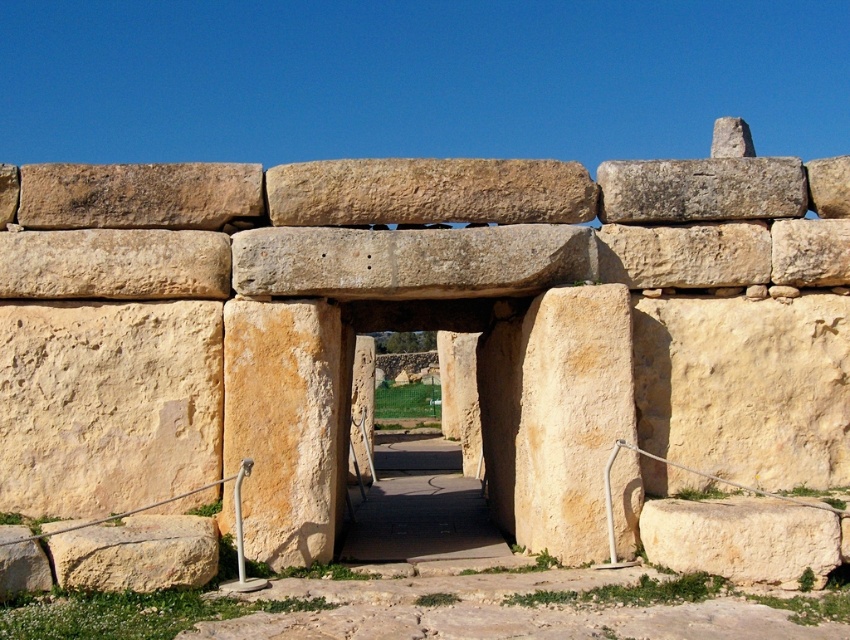
Is yellowish stone at upper right below beige rough stone at lower left?

No.

Can you confirm if yellowish stone at upper right is bigger than beige rough stone at lower left?

Indeed, yellowish stone at upper right has a larger size compared to beige rough stone at lower left.

Is point (833, 220) more distant than point (41, 561)?

Yes, it is behind point (41, 561).

What are the coordinates of `yellowish stone at upper right` in the screenshot? It's located at (809, 252).

Between yellowish sandstone at lower right and yellowish stone at upper center, which one has less height?

Standing shorter between the two is yellowish sandstone at lower right.

Is yellowish sandstone at lower right taller than yellowish stone at upper center?

No, yellowish sandstone at lower right is not taller than yellowish stone at upper center.

Identify the location of yellowish sandstone at lower right. (741, 538).

Measure the distance from yellowish sandstone at upper center to brown weathered stone at upper left.

yellowish sandstone at upper center is 1.76 meters away from brown weathered stone at upper left.

In the scene shown: Measure the distance between yellowish sandstone at upper center and camera.

A distance of 114.37 feet exists between yellowish sandstone at upper center and camera.

The image size is (850, 640). In order to click on yellowish sandstone at upper center in this screenshot , I will do `click(114, 262)`.